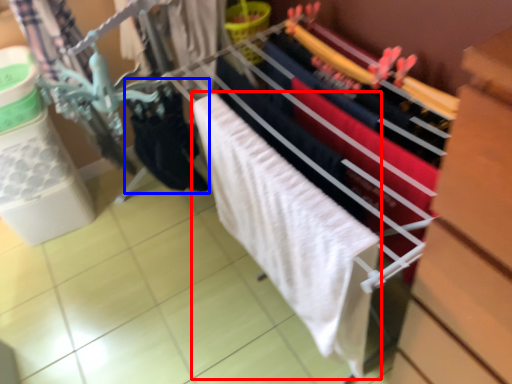
Question: Among these objects, which one is farthest to the camera, bath towel (highlighted by a red box) or clothing (highlighted by a blue box)?

Choices:
 (A) bath towel
 (B) clothing

Answer: (B)